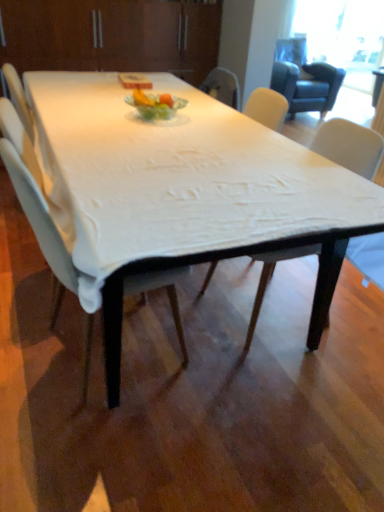
Locate an element on the screen. Image resolution: width=384 pixels, height=512 pixels. vacant point to the right of white fabric chair at center, the first chair viewed from the right is located at coordinates (349, 322).